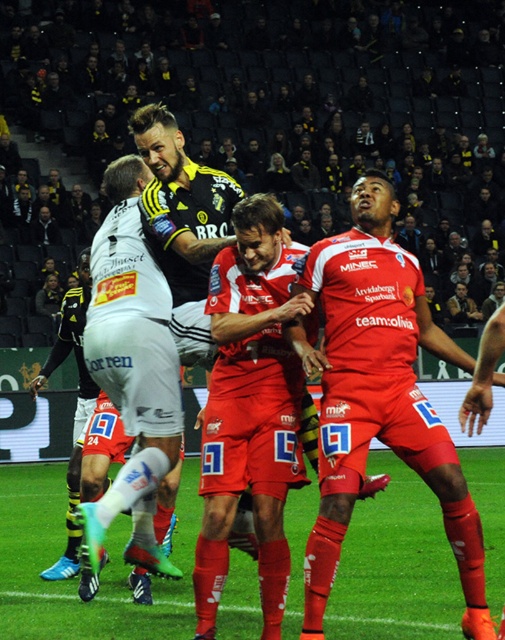
Question: Which object is the farthest from the green grass football field at center?

Choices:
 (A) red matte soccer player at center
 (B) black jersey at center
 (C) matte red shorts at center

Answer: (B)

Question: Can you confirm if green grass football field at center is bigger than white matte shorts at center?

Choices:
 (A) no
 (B) yes

Answer: (B)

Question: In this image, where is green grass football field at center located relative to black jersey at center?

Choices:
 (A) below
 (B) above

Answer: (A)

Question: Among these points, which one is nearest to the camera?

Choices:
 (A) (404, 280)
 (B) (154, 582)
 (C) (158, 237)
 (D) (270, 384)

Answer: (D)

Question: Which of the following is the closest to the observer?

Choices:
 (A) (233, 500)
 (B) (92, 307)
 (C) (421, 596)

Answer: (A)

Question: Can you confirm if red matte soccer player at center is positioned to the left of matte red shorts at center?

Choices:
 (A) no
 (B) yes

Answer: (A)